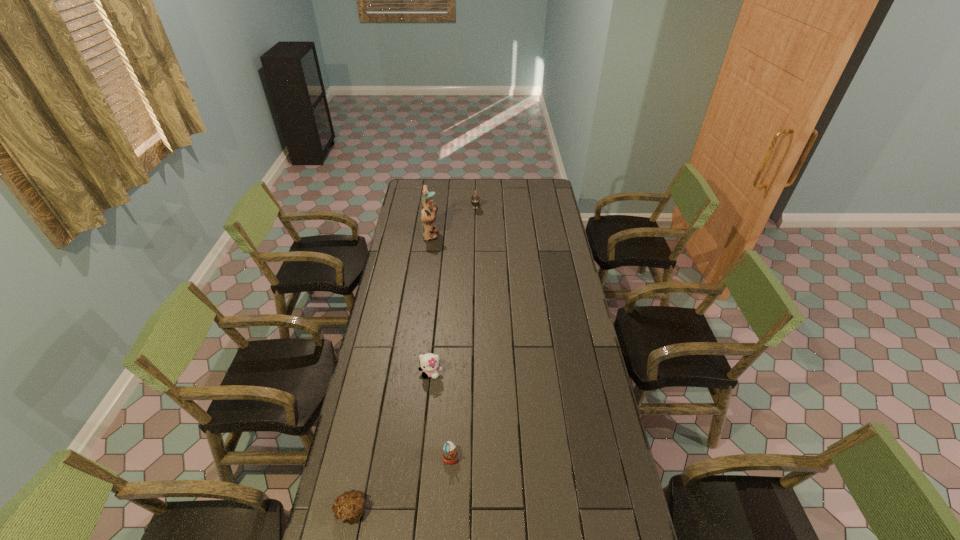
At what (x,y) coordinates should I click in order to perform the action: click on free spot located 0.070m on the front-facing side of the figurine. Please return your answer as a coordinate pair (x, y). The height and width of the screenshot is (540, 960). Looking at the image, I should click on (452, 235).

At what (x,y) coordinates should I click in order to perform the action: click on free location located on the front-facing side of the left kitten. Please return your answer as a coordinate pair (x, y). Looking at the image, I should click on (420, 486).

The width and height of the screenshot is (960, 540). What are the coordinates of `free point located on the front-facing side of the rightmost object` in the screenshot? It's located at (475, 233).

Identify the location of free region located 0.050m on the front-facing side of the fourth farthest object. (473, 457).

At what (x,y) coordinates should I click in order to perform the action: click on free space located 0.210m on the back of the leftmost object. Please return your answer as a coordinate pair (x, y). Looking at the image, I should click on (367, 433).

The width and height of the screenshot is (960, 540). Find the location of `object that is at the far edge`. object that is at the far edge is located at coordinates (475, 198).

Where is `figurine at the left edge`? The width and height of the screenshot is (960, 540). figurine at the left edge is located at coordinates (428, 209).

At what (x,y) coordinates should I click in order to perform the action: click on muffin present at the left edge. Please return your answer as a coordinate pair (x, y). The image size is (960, 540). Looking at the image, I should click on [x=349, y=506].

Where is `free space at the left edge`? This screenshot has width=960, height=540. free space at the left edge is located at coordinates (403, 244).

Image resolution: width=960 pixels, height=540 pixels. In the image, there is a desktop. In order to click on free space at the right edge in this screenshot , I will do `click(601, 522)`.